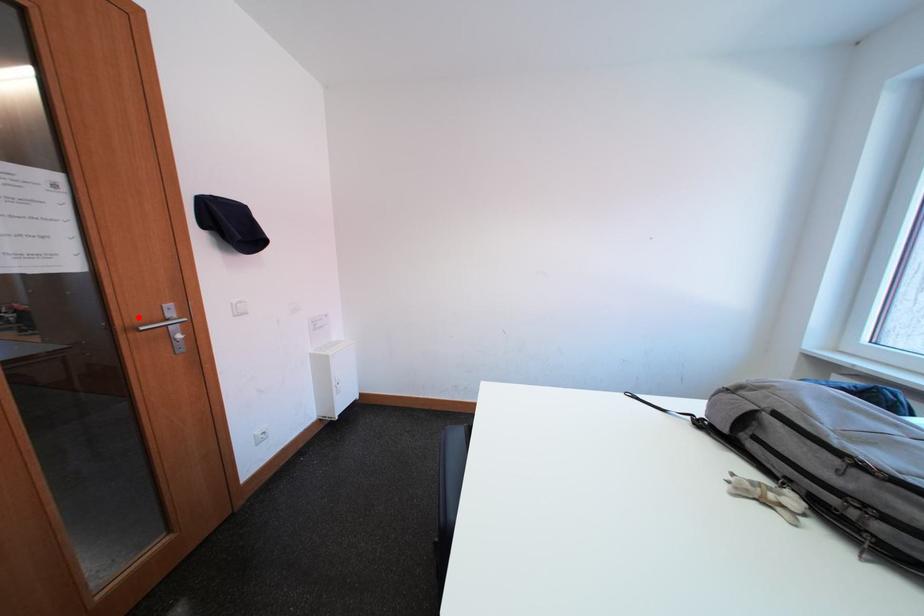
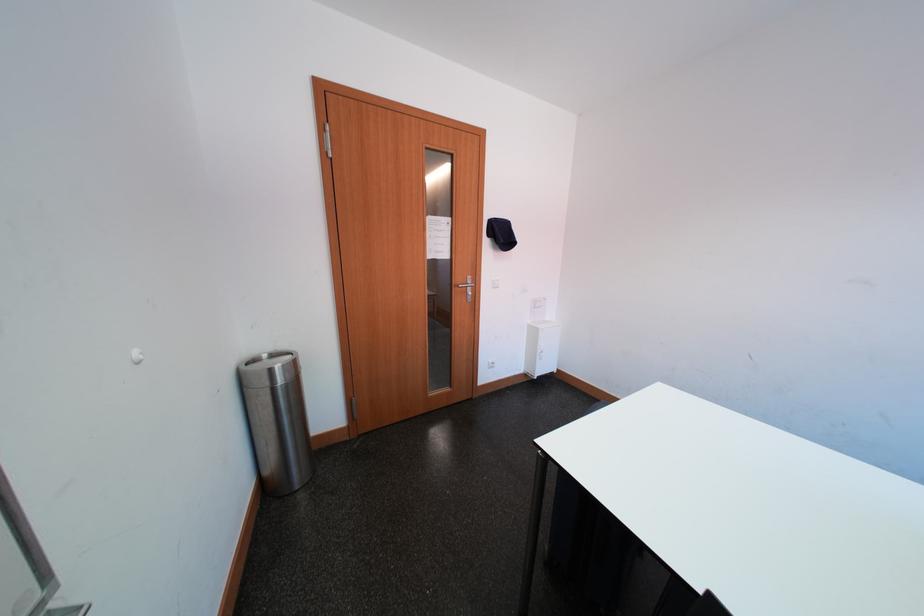
The point at the highlighted location is marked in the first image. Where is the corresponding point in the second image?

(467, 283)